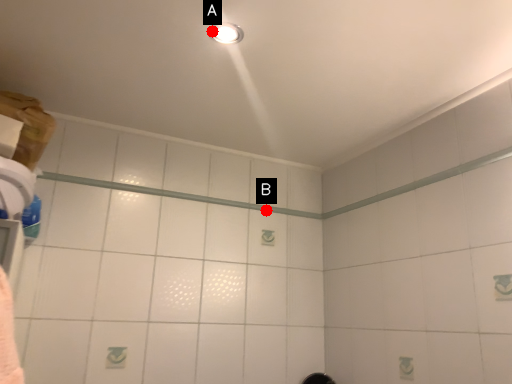
Question: Two points are circled on the image, labeled by A and B beside each circle. Which of the following is the closest to the observer?

Choices:
 (A) A is closer
 (B) B is closer

Answer: (A)